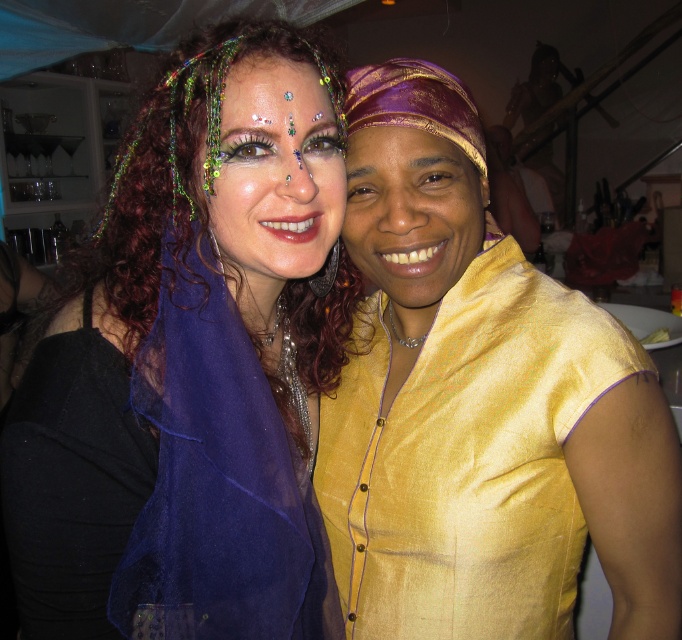
Question: Where is gold silk blouse at center located in relation to shiny green headband at center in the image?

Choices:
 (A) above
 (B) below

Answer: (B)

Question: Which point is closer to the camera?

Choices:
 (A) shiny green headband at center
 (B) gold silk blouse at center
 (C) matte black dress at center

Answer: (C)

Question: In this image, where is shiny green headband at center located relative to gold silk scarf at right?

Choices:
 (A) right
 (B) left

Answer: (B)

Question: Which point appears closest to the camera in this image?

Choices:
 (A) (x=460, y=230)
 (B) (x=424, y=204)
 (C) (x=293, y=228)
 (D) (x=237, y=452)

Answer: (D)

Question: Does gold silk blouse at center have a lesser width compared to shiny green headband at center?

Choices:
 (A) yes
 (B) no

Answer: (B)

Question: Estimate the real-world distances between objects in this image. Which object is farther from the gold silk blouse at center?

Choices:
 (A) matte black dress at center
 (B) shiny green headband at center
 (C) gold silk scarf at right

Answer: (B)